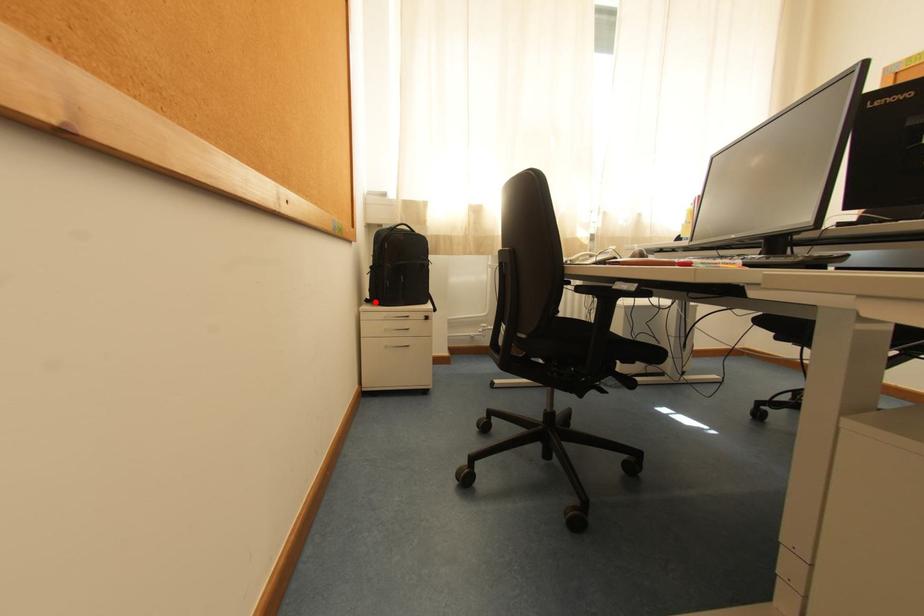
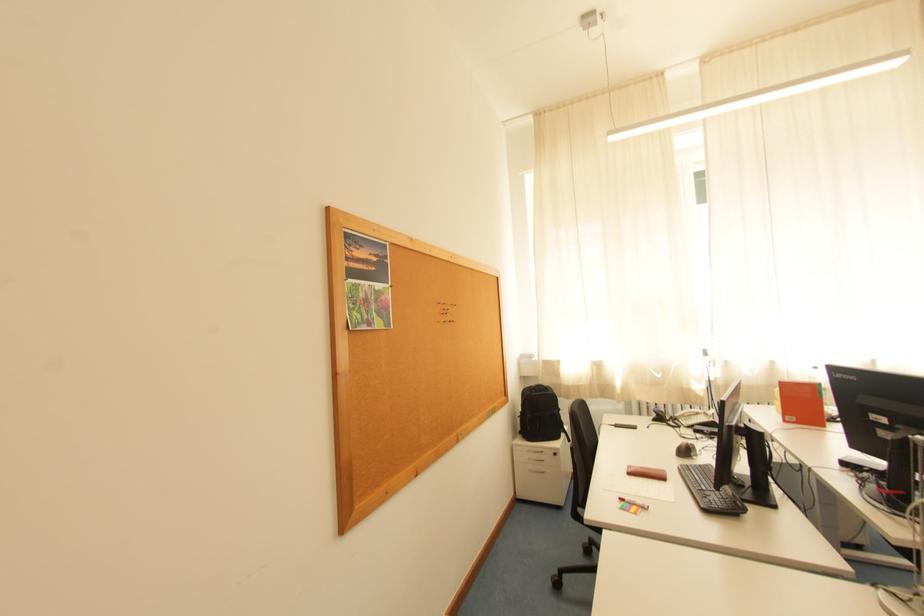
Locate, in the second image, the point that corresponds to the highlighted location in the first image.

(528, 434)